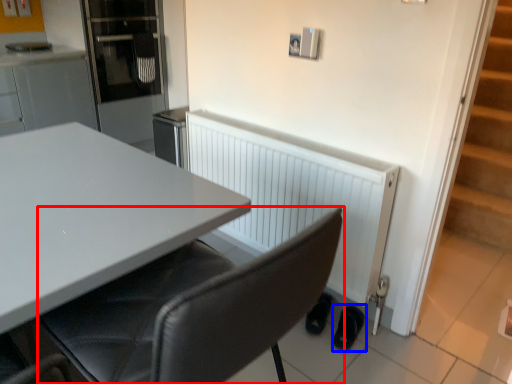
Question: Which object appears closest to the camera in this image, chair (highlighted by a red box) or footwear (highlighted by a blue box)?

Choices:
 (A) chair
 (B) footwear

Answer: (A)